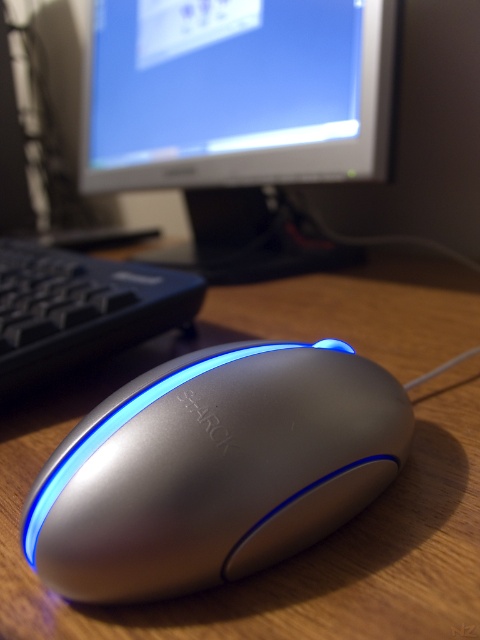
Question: Which of the following is the closest to the observer?

Choices:
 (A) black plastic keyboard at left
 (B) satin silver mouse at center
 (C) matte plastic monitor at upper center

Answer: (B)

Question: From the image, what is the correct spatial relationship of satin silver mouse at center in relation to matte plastic monitor at upper center?

Choices:
 (A) below
 (B) above

Answer: (A)

Question: Which point appears farthest from the camera in this image?

Choices:
 (A) [166, 6]
 (B) [160, 512]

Answer: (A)

Question: Which of the following is the closest to the observer?

Choices:
 (A) (146, 275)
 (B) (292, 97)
 (C) (283, 509)

Answer: (C)

Question: Is matte plastic monitor at upper center further to the viewer compared to black plastic keyboard at left?

Choices:
 (A) no
 (B) yes

Answer: (B)

Question: Is satin silver mouse at center to the left of matte plastic monitor at upper center from the viewer's perspective?

Choices:
 (A) no
 (B) yes

Answer: (A)